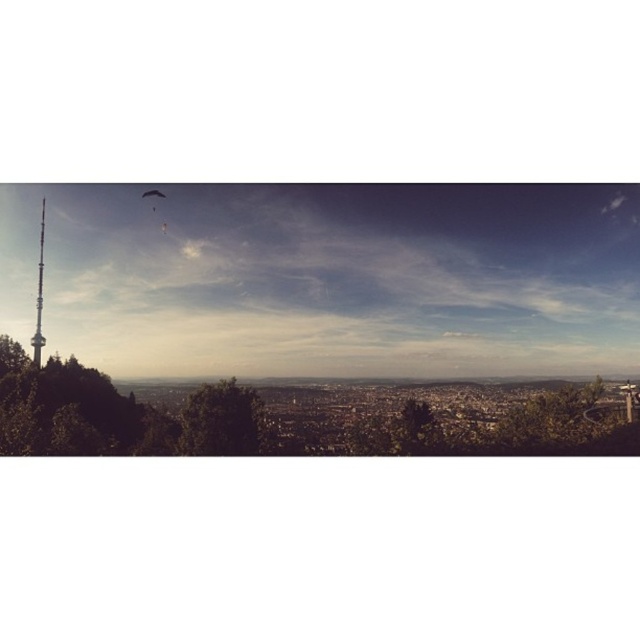
Question: Can you confirm if green leafy tree at left is positioned below smooth silver spire at left?

Choices:
 (A) yes
 (B) no

Answer: (A)

Question: Does green leafy tree at left come behind smooth silver spire at left?

Choices:
 (A) no
 (B) yes

Answer: (A)

Question: Which point is closer to the camera?

Choices:
 (A) green leafy tree at left
 (B) smooth silver spire at left
 (C) green leafy tree at center

Answer: (C)

Question: Which object is farther from the camera taking this photo?

Choices:
 (A) smooth silver spire at left
 (B) green leafy tree at left
 (C) green leafy tree at center

Answer: (A)

Question: Can you confirm if green leafy tree at center is positioned to the left of smooth silver spire at left?

Choices:
 (A) yes
 (B) no

Answer: (B)

Question: Which of these objects is positioned closest to the green leafy tree at left?

Choices:
 (A) smooth silver spire at left
 (B) green leafy tree at center

Answer: (A)